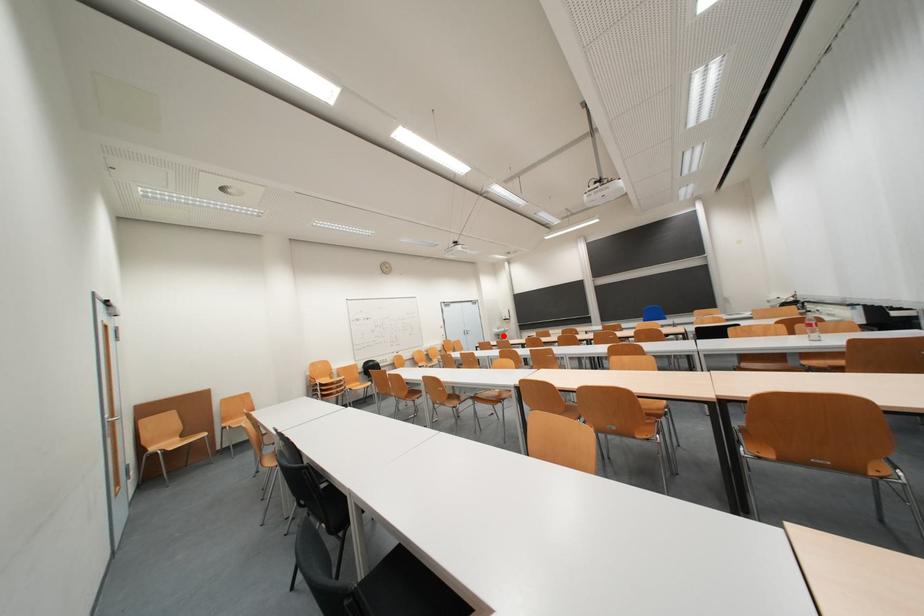
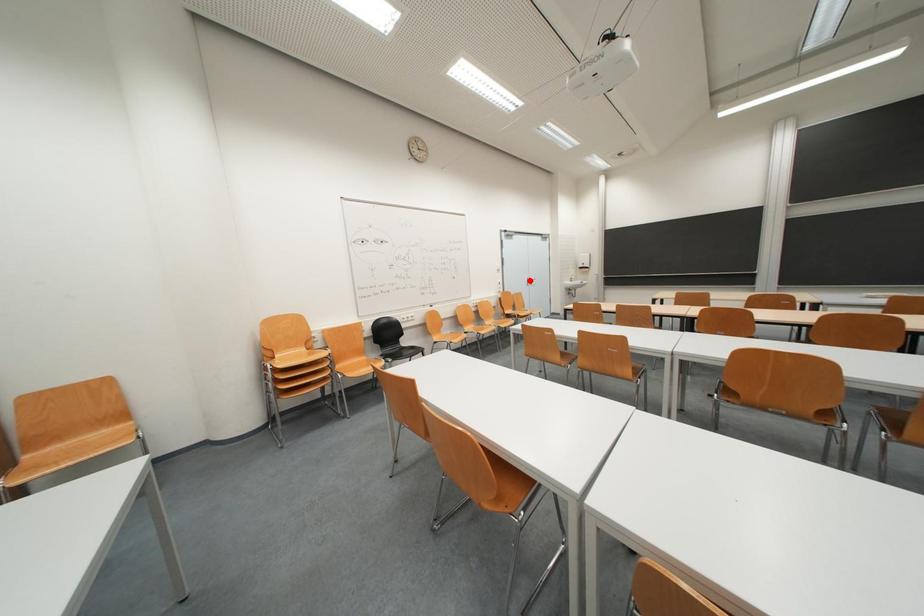
I am providing you with two images of the same scene from different viewpoints. A red point is marked on the first image and another point is marked on the second image. Do the highlighted points in image1 and image2 indicate the same real-world spot?

No